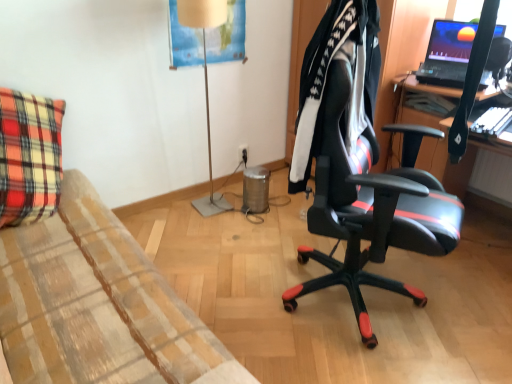
Question: Is black plastic power outlet at center in front of or behind matte beige lamp at center in the image?

Choices:
 (A) front
 (B) behind

Answer: (B)

Question: Is black plastic power outlet at center inside the boundaries of matte beige lamp at center, or outside?

Choices:
 (A) inside
 (B) outside

Answer: (B)

Question: Based on their relative distances, which object is farther from the matte beige lamp at center?

Choices:
 (A) black leather office chair at center
 (B) black leather jacket at center
 (C) matte black laptop at upper right
 (D) black plastic power outlet at center

Answer: (A)

Question: Estimate the real-world distances between objects in this image. Which object is closer to the black leather jacket at center?

Choices:
 (A) black plastic power outlet at center
 (B) matte black laptop at upper right
 (C) black leather office chair at center
 (D) matte beige lamp at center

Answer: (C)